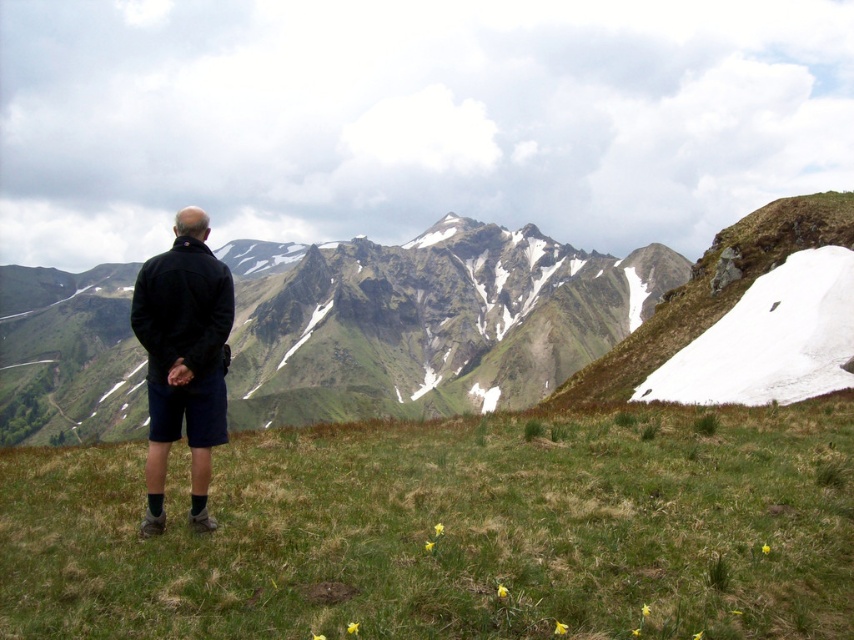
You are standing at the point with coordinates point (x=10, y=449) and want to walk towards the point (x=537, y=392). Which direction should you move to reach it?

You should move backward because point (x=10, y=449) is in front of point (x=537, y=392).

You are standing at the grassy vantage point and want to place a small picnic basket between the green grassy at center and the black matte jacket at center. Which object should you place it closer to so that it doesn

The green grassy at center is wider than the black matte jacket at center, so placing the picnic basket closer to the black matte jacket at center would ensure it is within the visible area.

You are standing at the grassy vantage point and want to walk towards the green grassy mountain at center. Which direction should you move relative to the green grassy at center?

The green grassy at center is to the right of the green grassy mountain at center, so you should move to the left of the green grassy at center to reach the green grassy mountain at center.